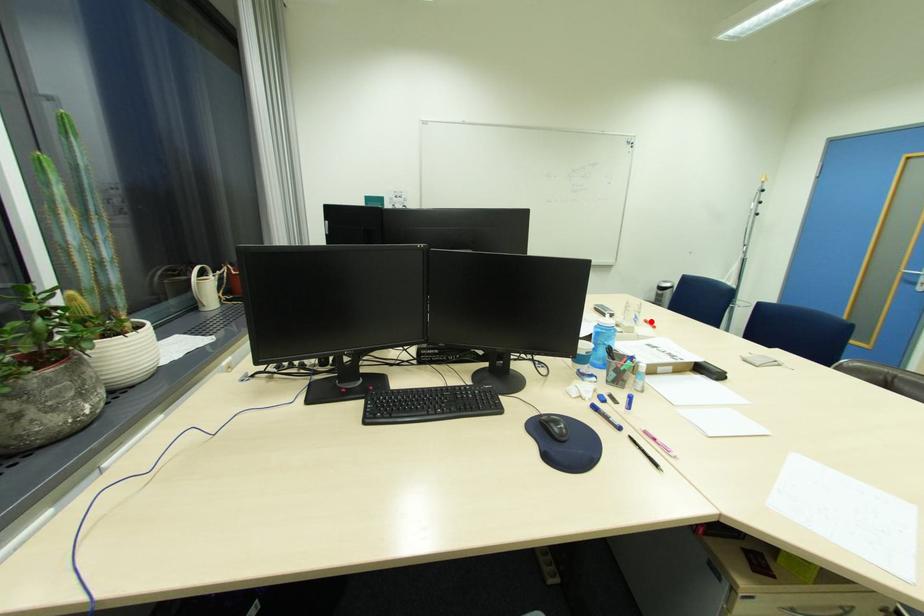
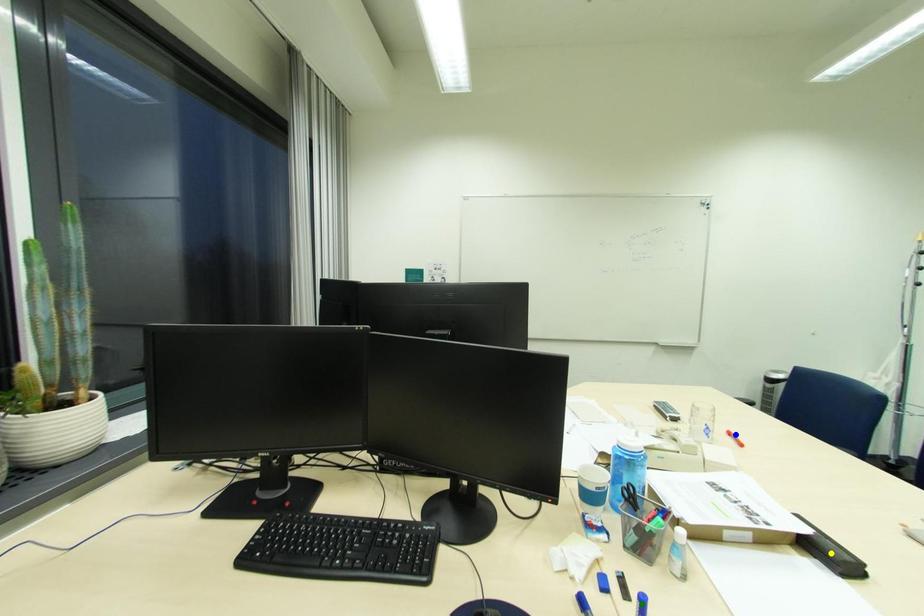
Question: I am providing you with two images of the same scene from different viewpoints. A red point is marked on the first image. You are given multiple points on the second image. In image 2, which mark is for the same physical point as the one in image 1?

Choices:
 (A) yellow point
 (B) blue point
 (C) green point

Answer: (B)